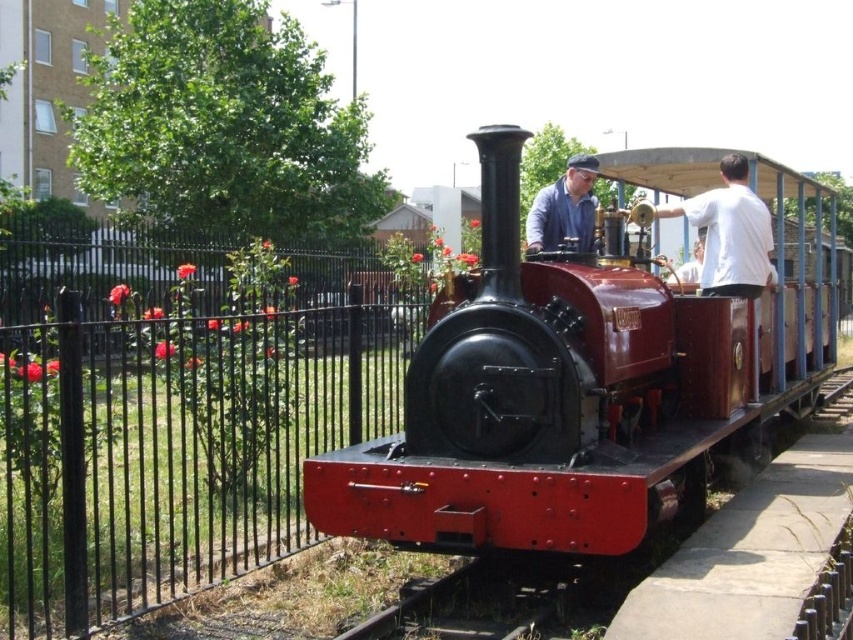
Question: Can you confirm if black metal fence at left is wider than matte blue shirt at center?

Choices:
 (A) no
 (B) yes

Answer: (A)

Question: Among these objects, which one is nearest to the camera?

Choices:
 (A) black metal train track at lower center
 (B) white cotton shirt at upper right
 (C) black metal fence at left
 (D) shiny red locomotive at center

Answer: (A)

Question: Is black metal fence at left above white cotton shirt at upper right?

Choices:
 (A) no
 (B) yes

Answer: (A)

Question: Is white cotton shirt at upper right to the left of matte blue shirt at center from the viewer's perspective?

Choices:
 (A) no
 (B) yes

Answer: (A)

Question: Which object is the closest to the matte blue shirt at center?

Choices:
 (A) white cotton shirt at upper right
 (B) black metal train track at lower center
 (C) black metal fence at left

Answer: (A)

Question: Which point is farther to the camera?

Choices:
 (A) (680, 387)
 (B) (270, 392)

Answer: (B)